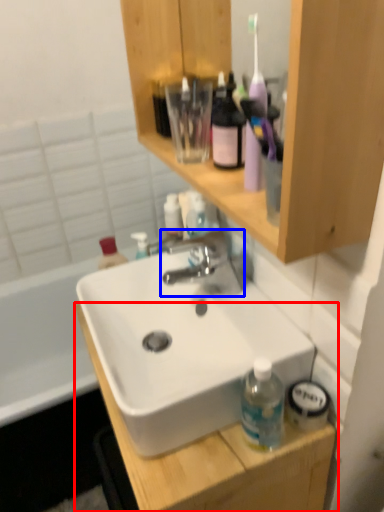
Question: Among these objects, which one is farthest to the camera, cabinetry (highlighted by a red box) or tap (highlighted by a blue box)?

Choices:
 (A) cabinetry
 (B) tap

Answer: (B)